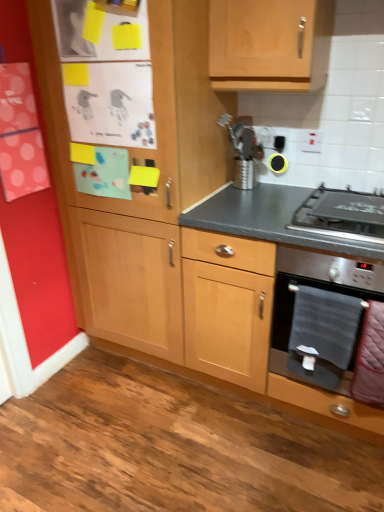
The height and width of the screenshot is (512, 384). I want to click on free space above stainless steel gas stove at lower right (from a real-world perspective), so click(348, 203).